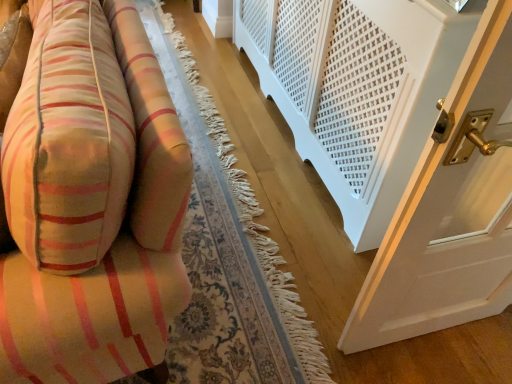
The image size is (512, 384). What do you see at coordinates (111, 190) in the screenshot? I see `soft cotton cushion at left` at bounding box center [111, 190].

The width and height of the screenshot is (512, 384). What are the coordinates of `soft cotton cushion at left` in the screenshot? It's located at (111, 190).

What do you see at coordinates (357, 90) in the screenshot? The width and height of the screenshot is (512, 384). I see `white textured radiator at lower right` at bounding box center [357, 90].

What is the approximate width of white textured radiator at lower right?

white textured radiator at lower right is 7.65 inches in width.

The image size is (512, 384). Find the location of `white textured radiator at lower right`. white textured radiator at lower right is located at coordinates (357, 90).

At what (x,y) coordinates should I click in order to perform the action: click on soft cotton cushion at left. Please return your answer as a coordinate pair (x, y). The height and width of the screenshot is (384, 512). Looking at the image, I should click on (111, 190).

Is white textured radiator at lower right to the right of soft cotton cushion at left from the viewer's perspective?

Correct, you'll find white textured radiator at lower right to the right of soft cotton cushion at left.

Is the depth of white textured radiator at lower right greater than that of soft cotton cushion at left?

Yes, it is behind soft cotton cushion at left.

Is point (358, 3) farther from camera compared to point (53, 161)?

Yes, point (358, 3) is farther from viewer.

From the image's perspective, is white textured radiator at lower right above soft cotton cushion at left?

Yes, from the image's perspective, white textured radiator at lower right is on top of soft cotton cushion at left.

From a real-world perspective, is white textured radiator at lower right positioned above or below soft cotton cushion at left?

white textured radiator at lower right is below soft cotton cushion at left.

Is white textured radiator at lower right thinner than soft cotton cushion at left?

Correct, the width of white textured radiator at lower right is less than that of soft cotton cushion at left.

Which of these two, white textured radiator at lower right or soft cotton cushion at left, stands taller?

With more height is white textured radiator at lower right.

Does white textured radiator at lower right have a smaller size compared to soft cotton cushion at left?

Incorrect, white textured radiator at lower right is not smaller in size than soft cotton cushion at left.

Do you think white textured radiator at lower right is within soft cotton cushion at left, or outside of it?

white textured radiator at lower right lies outside soft cotton cushion at left.

Are white textured radiator at lower right and soft cotton cushion at left located far from each other?

That's not correct — white textured radiator at lower right is a little close to soft cotton cushion at left.

Is white textured radiator at lower right oriented towards soft cotton cushion at left?

Yes, white textured radiator at lower right is facing soft cotton cushion at left.

There is a white textured radiator at lower right. Where is `furniture above it (from a real-world perspective)`? furniture above it (from a real-world perspective) is located at coordinates (111, 190).

Does soft cotton cushion at left appear on the left side of white textured radiator at lower right?

Indeed, soft cotton cushion at left is positioned on the left side of white textured radiator at lower right.

Considering the positions of objects soft cotton cushion at left and white textured radiator at lower right in the image provided, who is in front, soft cotton cushion at left or white textured radiator at lower right?

soft cotton cushion at left is more forward.

Is point (87, 107) positioned after point (343, 68)?

No, (87, 107) is closer to viewer.

From the image's perspective, between soft cotton cushion at left and white textured radiator at lower right, who is located below?

soft cotton cushion at left.

From a real-world perspective, is soft cotton cushion at left located higher than white textured radiator at lower right?

Yes.

Considering the relative sizes of soft cotton cushion at left and white textured radiator at lower right in the image provided, is soft cotton cushion at left wider than white textured radiator at lower right?

Indeed, soft cotton cushion at left has a greater width compared to white textured radiator at lower right.

Is soft cotton cushion at left taller or shorter than white textured radiator at lower right?

Considering their sizes, soft cotton cushion at left has less height than white textured radiator at lower right.

Is soft cotton cushion at left bigger than white textured radiator at lower right?

No.

Is soft cotton cushion at left not inside white textured radiator at lower right?

Indeed, soft cotton cushion at left is completely outside white textured radiator at lower right.

Is there a large distance between soft cotton cushion at left and white textured radiator at lower right?

No.

Is white textured radiator at lower right at the back of soft cotton cushion at left?

No, white textured radiator at lower right is not at the back of soft cotton cushion at left.

From the picture: What's the angular difference between soft cotton cushion at left and white textured radiator at lower right's facing directions?

There is a 35.7-degree angle between the facing directions of soft cotton cushion at left and white textured radiator at lower right.

Where is `furniture that is below the white textured radiator at lower right (from the image's perspective)`? The height and width of the screenshot is (384, 512). furniture that is below the white textured radiator at lower right (from the image's perspective) is located at coordinates (111, 190).

This screenshot has width=512, height=384. I want to click on balustrade below the soft cotton cushion at left (from a real-world perspective), so click(x=357, y=90).

This screenshot has height=384, width=512. What are the coordinates of `furniture above the white textured radiator at lower right (from a real-world perspective)` in the screenshot? It's located at (111, 190).